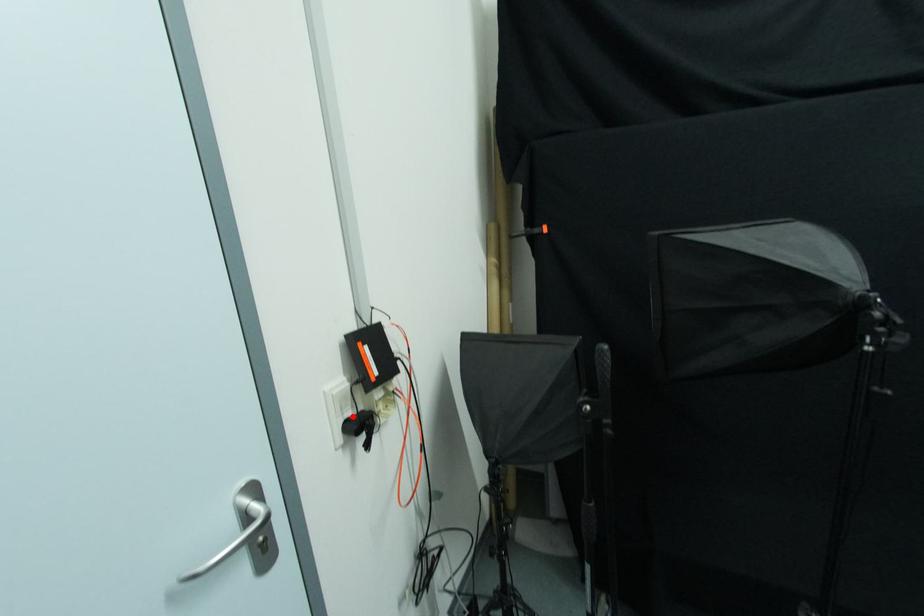
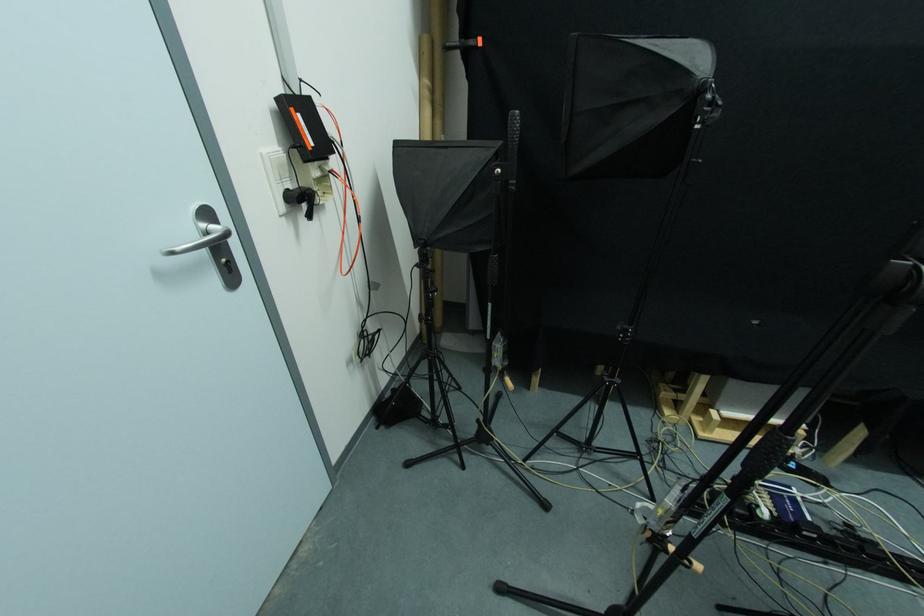
In the second image, find the point that corresponds to the highlighted location in the first image.

(292, 188)